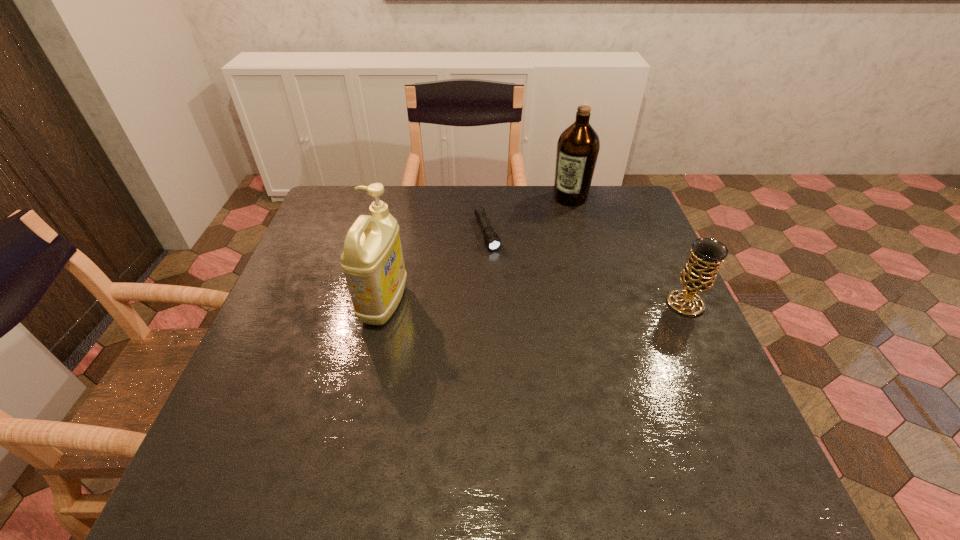
Locate an element on the screen. empty location between the third tallest object and the leftmost object is located at coordinates (535, 304).

Locate an element on the screen. This screenshot has height=540, width=960. free space that is in between the chalice and the detergent is located at coordinates (535, 304).

At what (x,y) coordinates should I click in order to perform the action: click on vacant area between the detergent and the rightmost object. Please return your answer as a coordinate pair (x, y). The image size is (960, 540). Looking at the image, I should click on (535, 304).

Locate an element on the screen. unoccupied area between the detergent and the chalice is located at coordinates (535, 304).

Identify the location of free point between the olive oil and the leftmost object. (477, 251).

Identify the location of vacant space that's between the olive oil and the leftmost object. pyautogui.click(x=477, y=251).

Select which object appears as the second closest to the third nearest object. Please provide its 2D coordinates. Your answer should be formatted as a tuple, i.e. [(x, y)], where the tuple contains the x and y coordinates of a point satisfying the conditions above.

[(372, 260)]

Identify which object is the third closest to the chalice. Please provide its 2D coordinates. Your answer should be formatted as a tuple, i.e. [(x, y)], where the tuple contains the x and y coordinates of a point satisfying the conditions above.

[(372, 260)]

You are a GUI agent. You are given a task and a screenshot of the screen. Output one action in this format:
    pyautogui.click(x=<x>, y=<y>)
    Task: Click on the vacant space that satisfies the following two spatial constraints: 1. on the back side of the flashlight; 2. on the right side of the detergent
    The image size is (960, 540).
    Given the screenshot: What is the action you would take?
    pyautogui.click(x=399, y=234)

Image resolution: width=960 pixels, height=540 pixels. Identify the location of free spot that satisfies the following two spatial constraints: 1. on the front side of the farthest object; 2. on the right side of the rightmost object. (599, 304).